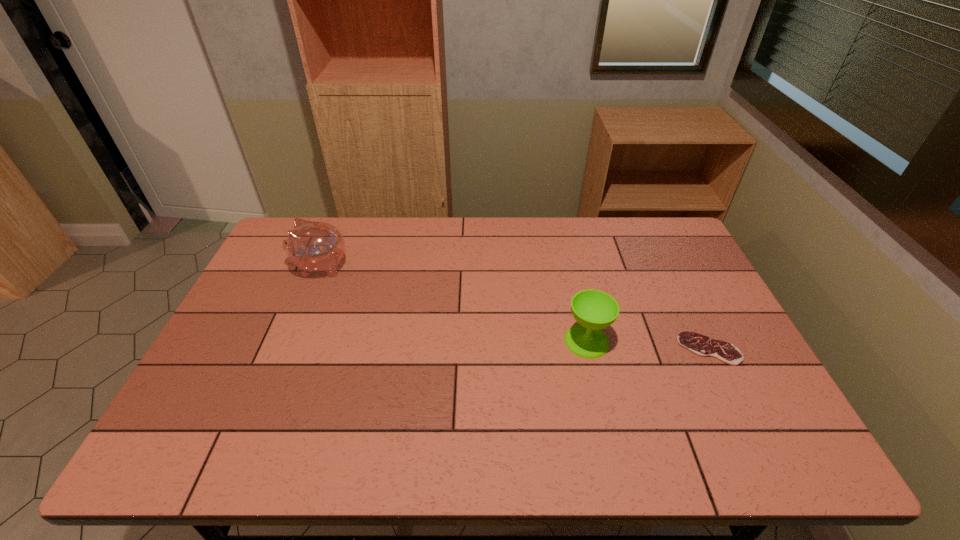
You are a GUI agent. You are given a task and a screenshot of the screen. Output one action in this format:
    pyautogui.click(x=<x>, y=<y>)
    Task: Click on the piggy bank
    This screenshot has height=540, width=960.
    Given the screenshot: What is the action you would take?
    coord(312,246)

The height and width of the screenshot is (540, 960). Find the location of `the tallest object`. the tallest object is located at coordinates (312, 246).

Locate an element on the screen. The height and width of the screenshot is (540, 960). the second shortest object is located at coordinates (594, 310).

This screenshot has height=540, width=960. Find the location of `wineglass`. wineglass is located at coordinates (594, 310).

In order to click on steak in this screenshot , I will do `click(699, 344)`.

This screenshot has height=540, width=960. I want to click on the shortest object, so pyautogui.click(x=699, y=344).

This screenshot has width=960, height=540. I want to click on vacant region located on the front facing side of the piggy bank, so click(274, 266).

Locate an element on the screen. Image resolution: width=960 pixels, height=540 pixels. vacant space located 0.080m on the front facing side of the piggy bank is located at coordinates pyautogui.click(x=267, y=266).

Where is `vacant space located 0.180m on the right of the second object from left to right`? The image size is (960, 540). vacant space located 0.180m on the right of the second object from left to right is located at coordinates (674, 341).

Find the location of `vacant position located 0.110m on the front of the shortest object`. vacant position located 0.110m on the front of the shortest object is located at coordinates (735, 403).